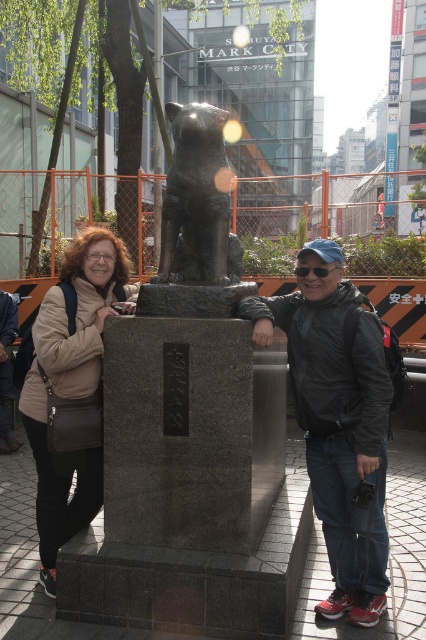
You are a photographer trying to capture a clear photo of the transparent plastic goggles at center without the matte black statue at center blocking it. Can you suggest a way to frame the shot so the statue isn

The matte black statue at center is taller than the transparent plastic goggles at center. To avoid the statue blocking the goggles, you can lower your camera angle so the statue appears below the goggles in the frame.

You are a tour guide leading a group to the Hachiko statue. A tourist asks if their bag can be placed between the matte brown leather bag at left and the black polished stone dog at center without touching either. The bag they have is 28 inches long. Can it fit?

The distance between the matte brown leather bag at left and the black polished stone dog at center is 30.17 inches. Since the tourist bag is 28 inches long, it can fit between them without touching either object.